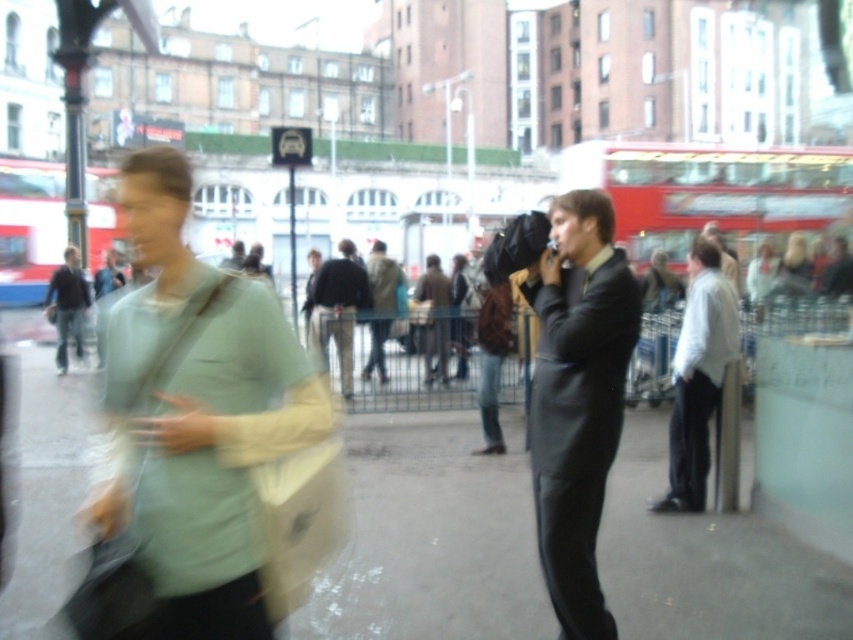
Question: Which object is farther from the camera taking this photo?

Choices:
 (A) brown leather jacket at center
 (B) red rubber bus at center
 (C) light brown leather jacket at center
 (D) light green fabric bag at left

Answer: (C)

Question: Does red rubber bus at center have a larger size compared to dark brown leather jacket at center?

Choices:
 (A) no
 (B) yes

Answer: (B)

Question: Which point is closer to the camera taking this photo?

Choices:
 (A) (436, 269)
 (B) (357, 289)

Answer: (B)

Question: Is red rubber bus at center below light gray shirt at right?

Choices:
 (A) yes
 (B) no

Answer: (B)

Question: Can you confirm if dark brown leather jacket at center is bigger than light brown leather jacket at center?

Choices:
 (A) yes
 (B) no

Answer: (B)

Question: Which object is the closest to the light brown leather jacket at center?

Choices:
 (A) brown leather jacket at center
 (B) red rubber bus at center

Answer: (A)